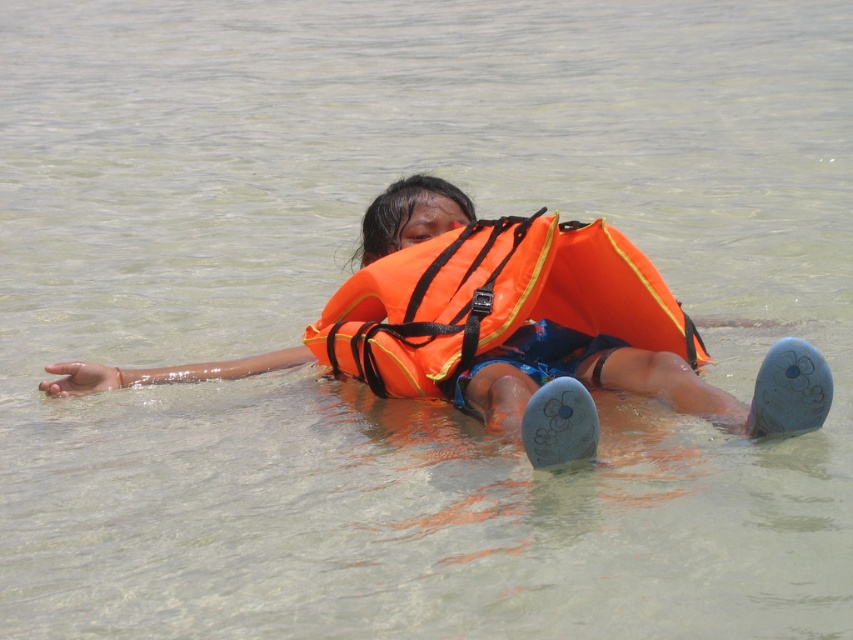
Based on the photo, is orange life vest at center thinner than orange fabric life vest at center?

Incorrect, orange life vest at center's width is not less than orange fabric life vest at center's.

Where is `orange life vest at center`? The width and height of the screenshot is (853, 640). orange life vest at center is located at coordinates (509, 330).